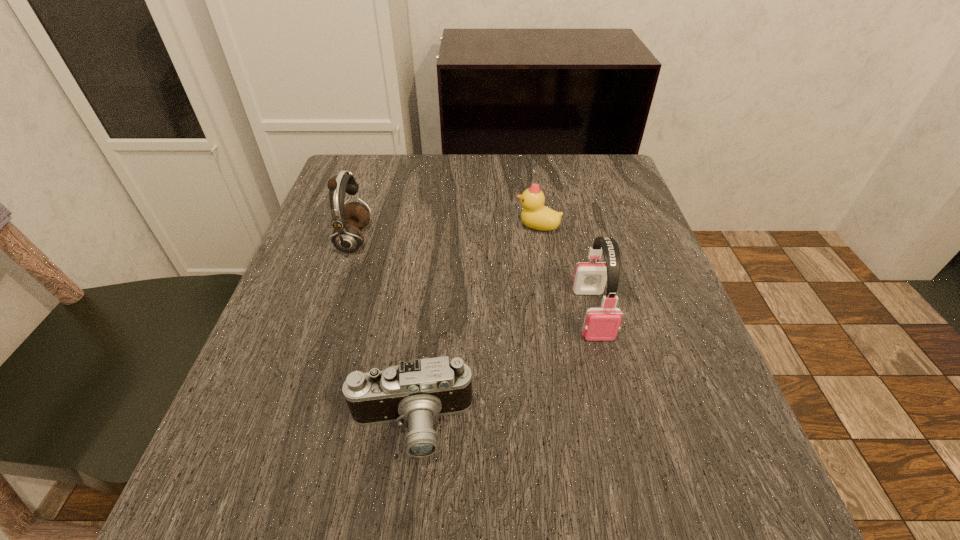
The image size is (960, 540). What are the coordinates of `free space located on the front-facing side of the duckling` in the screenshot? It's located at (448, 227).

In order to click on free space located on the front-facing side of the duckling in this screenshot , I will do `click(439, 227)`.

Find the location of a particular element. Image resolution: width=960 pixels, height=540 pixels. vacant area situated at the lens of the third object from right to left is located at coordinates (400, 514).

Find the location of a particular element. object that is at the left edge is located at coordinates (347, 220).

Identify the location of object at the right edge. (601, 324).

The width and height of the screenshot is (960, 540). I want to click on free region at the far edge, so click(393, 203).

The width and height of the screenshot is (960, 540). Identify the location of vacant region at the near edge of the desktop. (327, 516).

The width and height of the screenshot is (960, 540). In the image, there is a desktop. Identify the location of free space at the left edge. (321, 450).

Where is `free space at the right edge of the desktop`? This screenshot has width=960, height=540. free space at the right edge of the desktop is located at coordinates (681, 451).

In the image, there is a desktop. What are the coordinates of `vacant space at the far left corner` in the screenshot? It's located at 377,187.